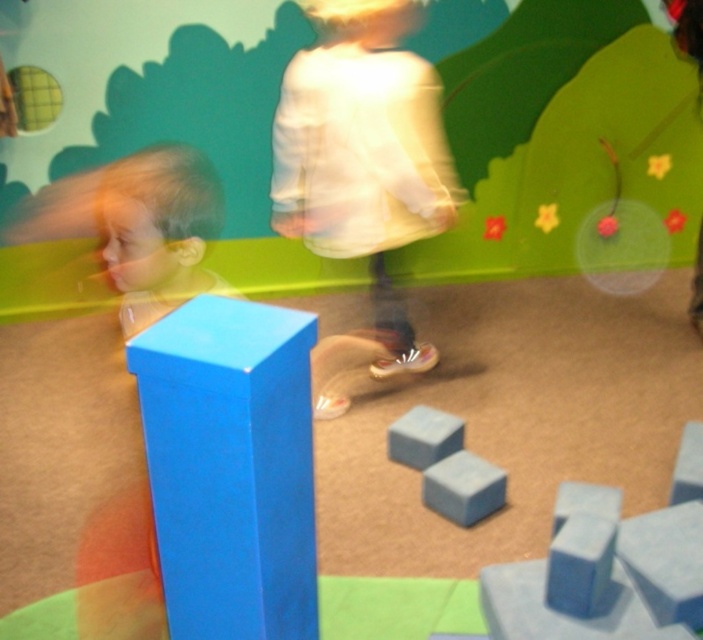
Does blue matte block at center have a larger size compared to smooth gray cube at center?

Incorrect, blue matte block at center is not larger than smooth gray cube at center.

Find the location of a particular element. Image resolution: width=703 pixels, height=640 pixels. blue matte block at center is located at coordinates (463, 486).

Find the location of a particular element. Image resolution: width=703 pixels, height=640 pixels. blue matte block at center is located at coordinates (463, 486).

Can you confirm if matte blue cube at center is bigger than smooth gray cube at center?

Correct, matte blue cube at center is larger in size than smooth gray cube at center.

Does matte blue cube at center lie in front of smooth gray cube at center?

Yes, it is.

Is point (198, 390) farther from camera compared to point (460, 433)?

No, (198, 390) is closer to viewer.

Locate an element on the screen. The width and height of the screenshot is (703, 640). matte blue cube at center is located at coordinates (231, 467).

Measure the distance from matte blue cube at center to blue matte block at center.

matte blue cube at center is 1.21 meters away from blue matte block at center.

Which is in front, point (276, 428) or point (498, 497)?

Point (276, 428) is more forward.

This screenshot has width=703, height=640. What are the coordinates of `matte blue cube at center` in the screenshot? It's located at (231, 467).